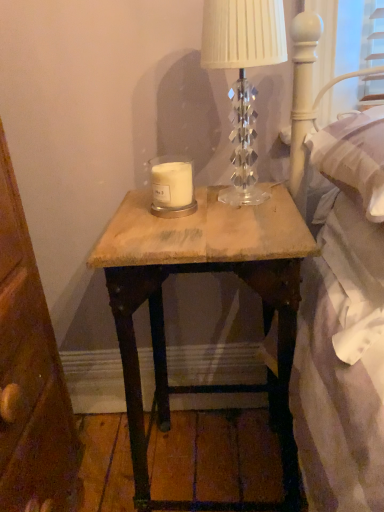
Find the location of a particular element. The width and height of the screenshot is (384, 512). free point below wooden nightstand at center (from a real-world perspective) is located at coordinates (230, 467).